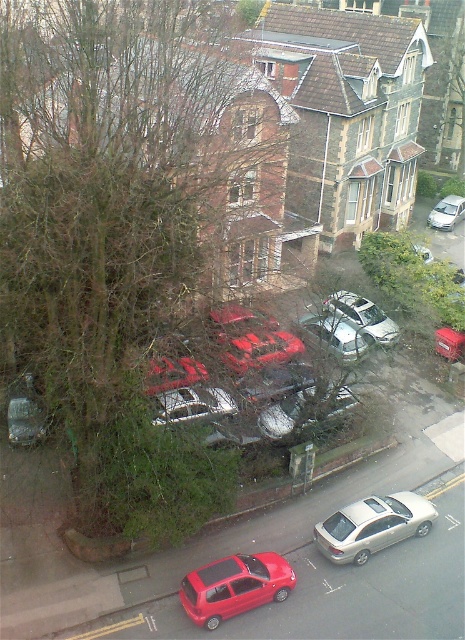
You are a delivery person needing to park your vehicle between the satin silver sedan at lower center and the satin silver suv at center. The length of your delivery van is 22 feet. Is there enough space between them to park your van?

The distance between the satin silver sedan at lower center and the satin silver suv at center is 40.15 feet. Since your delivery van is 22 feet long, there is sufficient space to park between them as 40.15 feet is greater than 22 feet.

You are standing at the edge of the residential area and want to locate two specific points marked in the image. Which of the two points, point 1 at coordinates [292,577] or point 2 at coordinates [407,531], is nearer to you?

Point 1 at coordinates [292,577] is closer to the viewer than point 2 at coordinates [407,531].

You are standing at the point labeled point (372, 525) in the residential area image. Which vehicle is directly in front of you?

The point labeled point (372, 525) corresponds to the satin silver sedan at lower center, so the vehicle directly in front of you is the satin silver sedan at lower center.